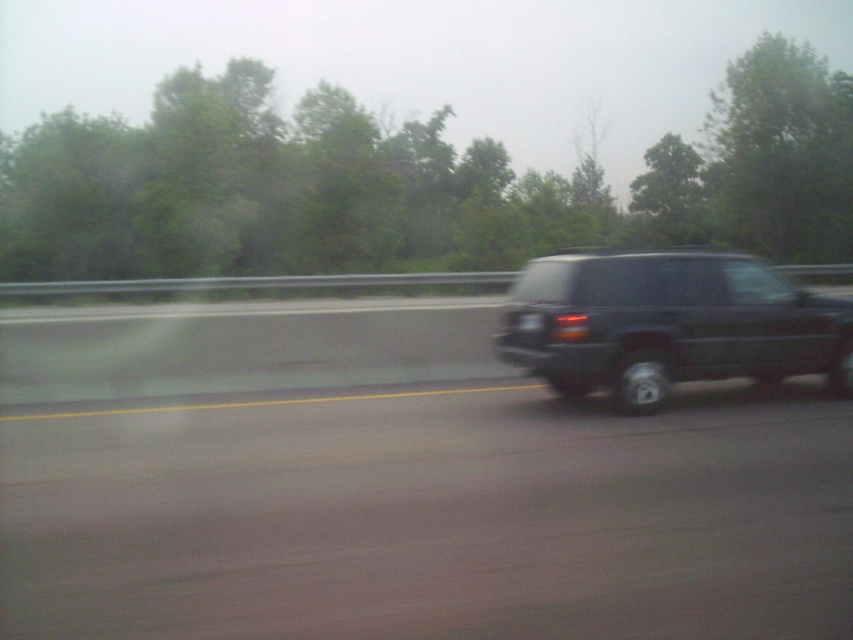
Question: Is green leafy tree at upper center wider than black matte suv at right?

Choices:
 (A) yes
 (B) no

Answer: (A)

Question: Does green leafy tree at upper center have a greater width compared to green leafy tree at upper right?

Choices:
 (A) no
 (B) yes

Answer: (B)

Question: Among these points, which one is nearest to the camera?

Choices:
 (A) (848, 227)
 (B) (534, 368)
 (C) (332, 234)

Answer: (B)

Question: Which point is closer to the camera taking this photo?

Choices:
 (A) (809, 52)
 (B) (640, 358)
 (C) (730, 170)

Answer: (B)

Question: Does green leafy tree at upper center appear under black matte suv at right?

Choices:
 (A) no
 (B) yes

Answer: (A)

Question: Estimate the real-world distances between objects in this image. Which object is farther from the black matte suv at right?

Choices:
 (A) green leafy tree at upper center
 (B) green leafy tree at upper right

Answer: (B)